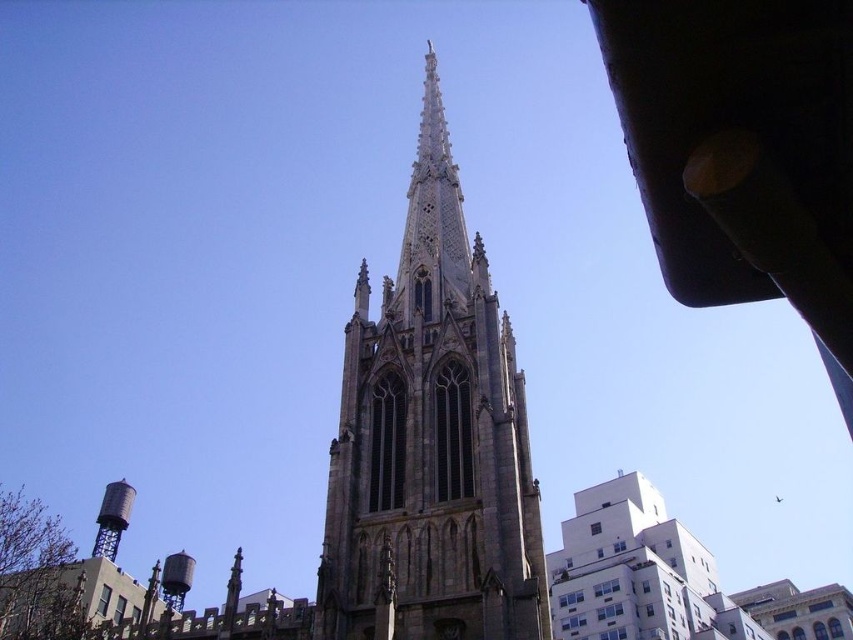
Is brown stone tower at center shorter than silver metallic water tower at lower left?

No.

Consider the image. Is brown stone tower at center further to the viewer compared to silver metallic water tower at lower left?

No, it is in front of silver metallic water tower at lower left.

Locate an element on the screen. brown stone tower at center is located at coordinates (431, 440).

Where is `brown stone tower at center`? The height and width of the screenshot is (640, 853). brown stone tower at center is located at coordinates (431, 440).